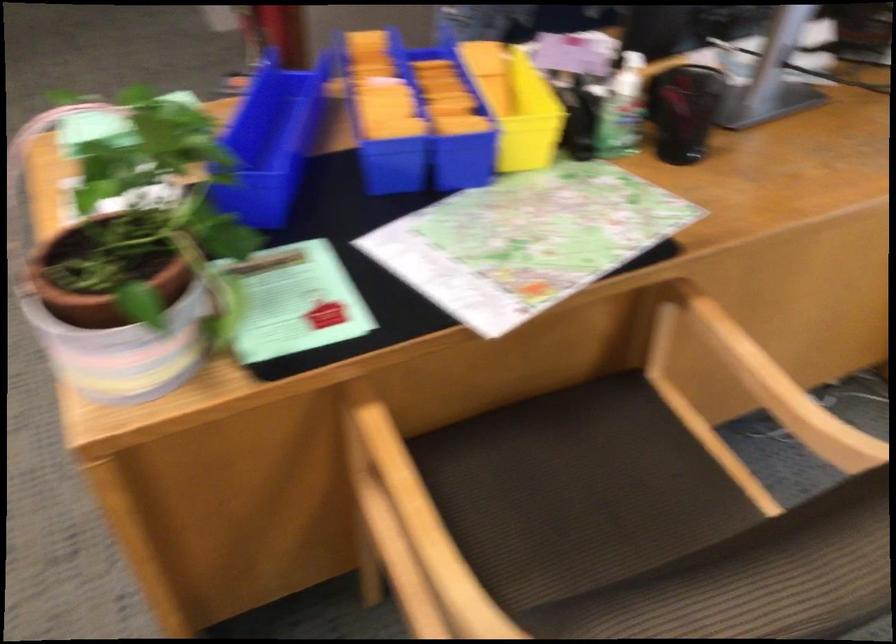
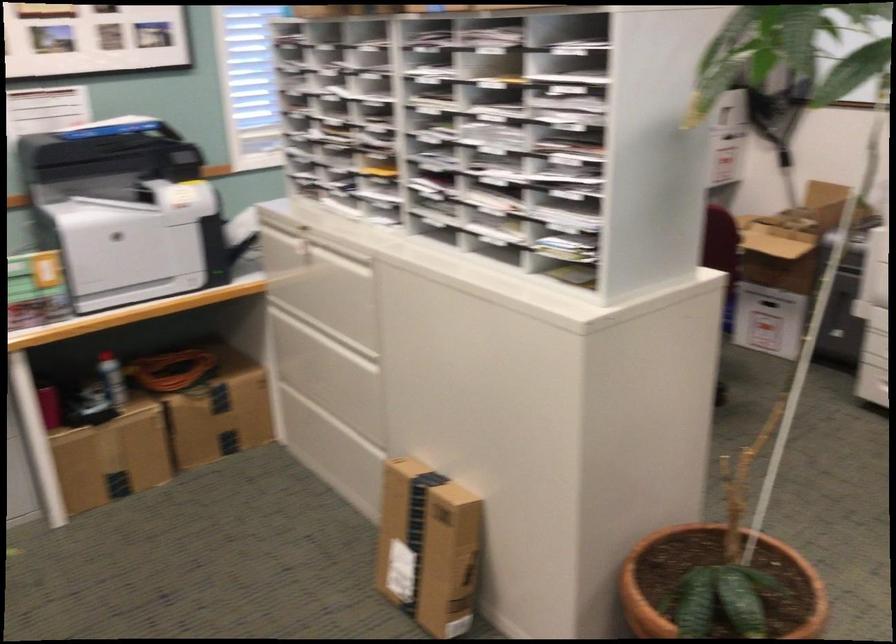
Question: The images are taken continuously from a first-person perspective. In which direction is your viewpoint rotating?

Choices:
 (A) Left
 (B) Right
 (C) Up
 (D) Down

Answer: (A)